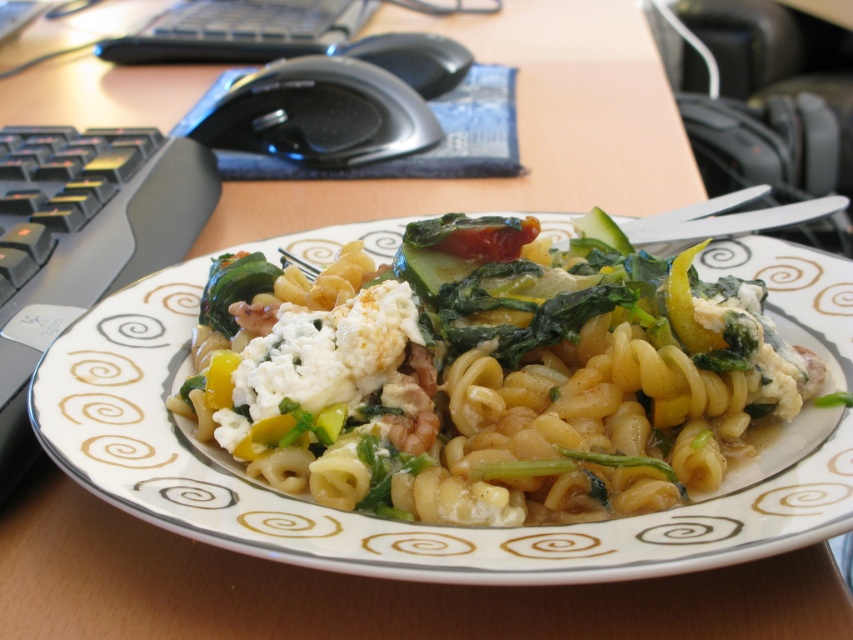
Question: Which point is farther to the camera?

Choices:
 (A) green leafy vegetable at center
 (B) white crumbly cheese at center

Answer: (A)

Question: Does yellow matte pasta at center appear over white crumbly cheese at center?

Choices:
 (A) no
 (B) yes

Answer: (B)

Question: Estimate the real-world distances between objects in this image. Which object is closer to the green leafy vegetable at center?

Choices:
 (A) yellow matte pasta at center
 (B) white crumbly cheese at center

Answer: (B)

Question: Which of the following is the closest to the observer?

Choices:
 (A) white crumbly cheese at center
 (B) green leafy vegetable at center

Answer: (A)

Question: Can you confirm if white crumbly cheese at center is bigger than green leafy vegetable at center?

Choices:
 (A) no
 (B) yes

Answer: (B)

Question: Is white crumbly cheese at center to the left of green leafy vegetable at center from the viewer's perspective?

Choices:
 (A) no
 (B) yes

Answer: (A)